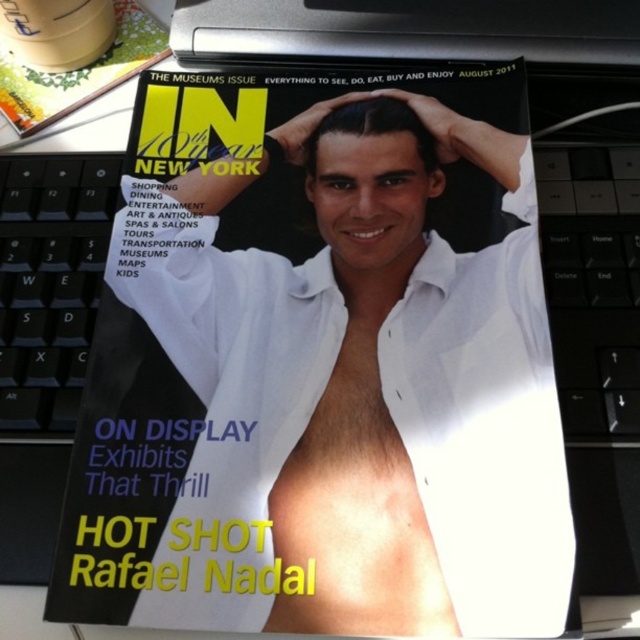
Question: Among these points, which one is farthest from the camera?

Choices:
 (A) (438, 394)
 (B) (67, 266)

Answer: (B)

Question: Is white matte shirt at center further to camera compared to black plastic keyboard at left?

Choices:
 (A) yes
 (B) no

Answer: (B)

Question: Does black plastic keyboard at left appear under matte yellow magazine at upper left?

Choices:
 (A) yes
 (B) no

Answer: (A)

Question: Based on their relative distances, which object is farther from the black plastic keyboard at left?

Choices:
 (A) white matte shirt at center
 (B) matte yellow magazine at upper left

Answer: (A)

Question: Can you confirm if white matte shirt at center is bigger than matte yellow magazine at upper left?

Choices:
 (A) no
 (B) yes

Answer: (B)

Question: Which point is closer to the camera taking this photo?

Choices:
 (A) (99, 42)
 (B) (68, 234)

Answer: (B)